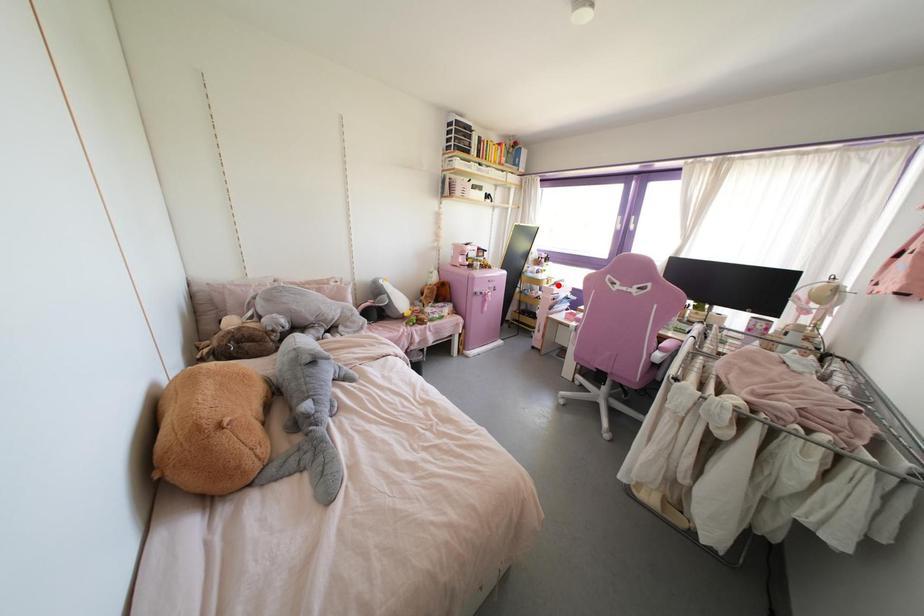
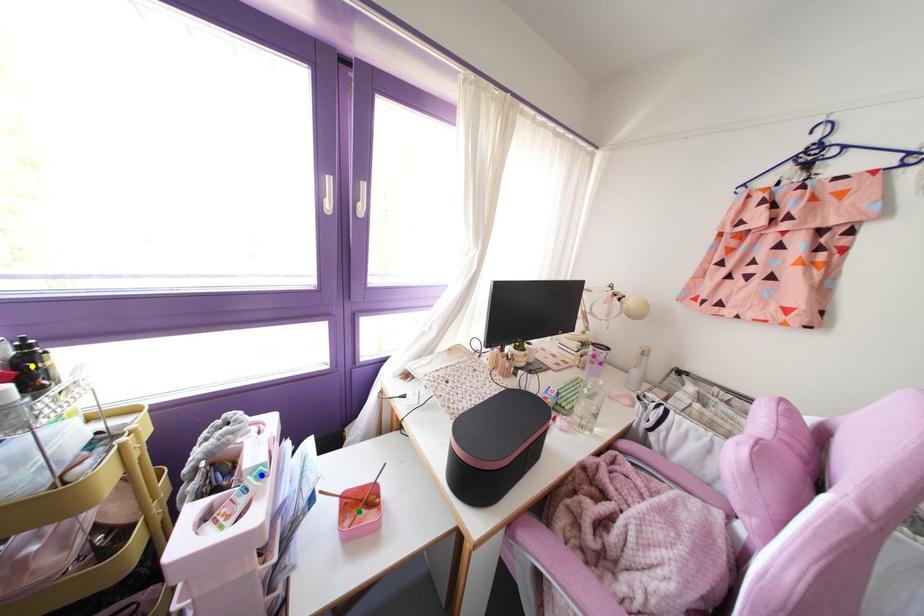
Question: I am providing you with two images of the same scene from different viewpoints. A red point is marked on the first image. You are given multiple points on the second image. Which mark in image 2 goes with the point in image 1?

Choices:
 (A) blue point
 (B) green point
 (C) yellow point

Answer: (A)